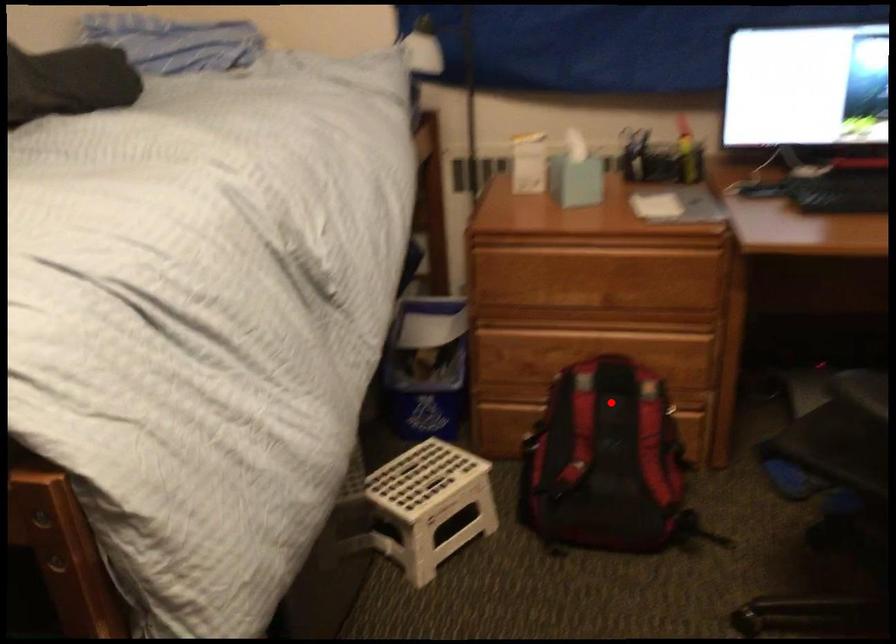
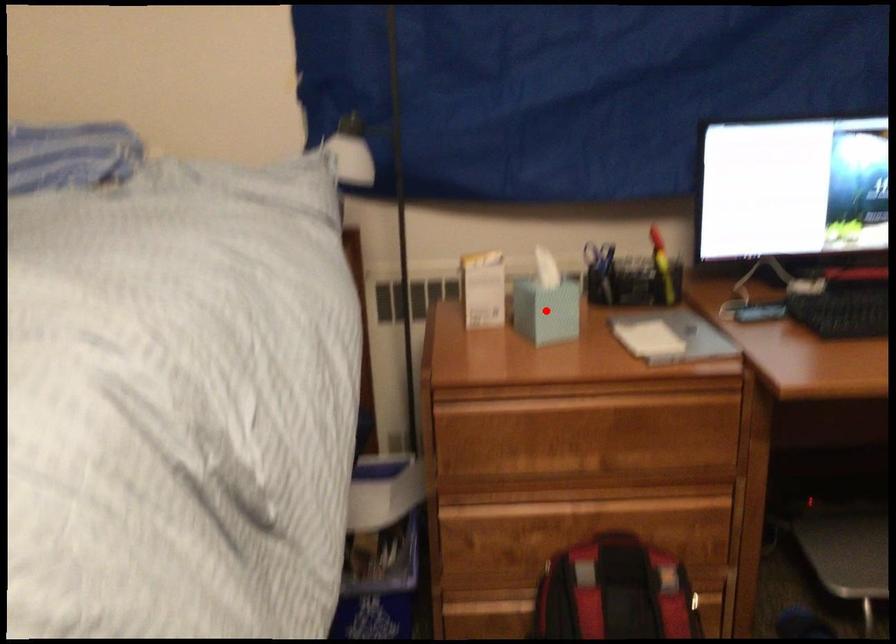
I am providing you with two images of the same scene from different viewpoints. A red point is marked on the first image and another point is marked on the second image. Does the point marked in image1 correspond to the same location as the one in image2?

No